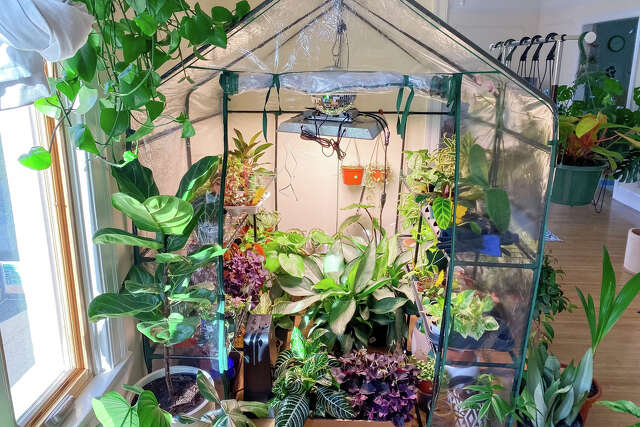
Where is `hooks`? The height and width of the screenshot is (427, 640). hooks is located at coordinates (527, 36), (534, 38), (547, 39), (586, 41), (509, 40), (502, 44).